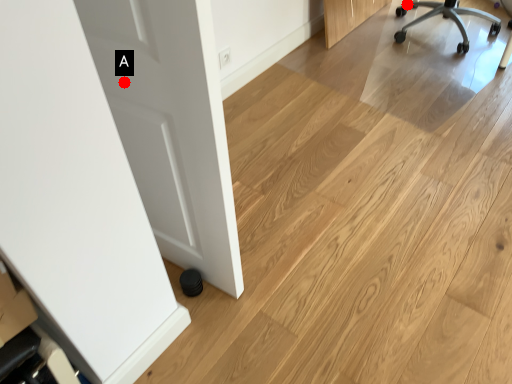
Question: Two points are circled on the image, labeled by A and B beside each circle. Among these points, which one is nearest to the camera?

Choices:
 (A) A is closer
 (B) B is closer

Answer: (A)